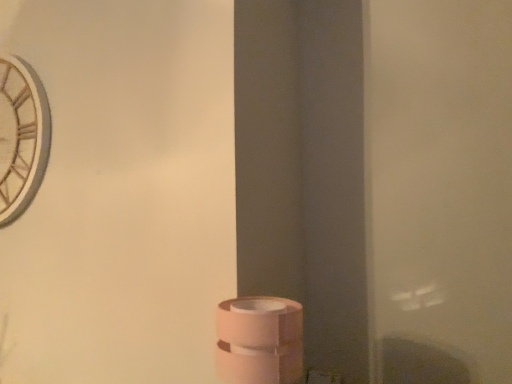
Where is `pink matte toilet paper at lower center`? The image size is (512, 384). pink matte toilet paper at lower center is located at coordinates (259, 341).

What is the approximate height of pink matte toilet paper at lower center?

pink matte toilet paper at lower center is 13.76 inches tall.

Image resolution: width=512 pixels, height=384 pixels. What do you see at coordinates (259, 341) in the screenshot? I see `pink matte toilet paper at lower center` at bounding box center [259, 341].

This screenshot has height=384, width=512. Describe the element at coordinates (21, 136) in the screenshot. I see `wooden clock at upper left` at that location.

Measure the distance between point (31, 94) and camera.

The depth of point (31, 94) is 1.38 meters.

The height and width of the screenshot is (384, 512). Find the location of `wooden clock at upper left`. wooden clock at upper left is located at coordinates (21, 136).

You are a GUI agent. You are given a task and a screenshot of the screen. Output one action in this format:
    pyautogui.click(x=<x>, y=<y>)
    Task: Click on the pink matte toilet paper at lower center
    The image size is (512, 384).
    Given the screenshot: What is the action you would take?
    pyautogui.click(x=259, y=341)

Between wooden clock at upper left and pink matte toilet paper at lower center, which one appears on the left side from the viewer's perspective?

wooden clock at upper left is more to the left.

Relative to pink matte toilet paper at lower center, is wooden clock at upper left in front or behind?

Visually, wooden clock at upper left is located behind pink matte toilet paper at lower center.

Considering the points (39, 106) and (227, 333), which point is in front, point (39, 106) or point (227, 333)?

Positioned in front is point (227, 333).

From the image's perspective, is wooden clock at upper left on pink matte toilet paper at lower center?

Correct, wooden clock at upper left appears higher than pink matte toilet paper at lower center in the image.

From a real-world perspective, does wooden clock at upper left sit lower than pink matte toilet paper at lower center?

No, from a real-world perspective, wooden clock at upper left is not below pink matte toilet paper at lower center.

Can you confirm if wooden clock at upper left is thinner than pink matte toilet paper at lower center?

Yes.

Can you confirm if wooden clock at upper left is shorter than pink matte toilet paper at lower center?

No, wooden clock at upper left is not shorter than pink matte toilet paper at lower center.

Is wooden clock at upper left bigger than pink matte toilet paper at lower center?

Indeed, wooden clock at upper left has a larger size compared to pink matte toilet paper at lower center.

Can we say wooden clock at upper left lies outside pink matte toilet paper at lower center?

Yes, wooden clock at upper left is not within pink matte toilet paper at lower center.

Is wooden clock at upper left not close to pink matte toilet paper at lower center?

No.

Is pink matte toilet paper at lower center at the back of wooden clock at upper left?

No.

Can you tell me how much wooden clock at upper left and pink matte toilet paper at lower center differ in facing direction?

They differ by 1.31 degrees in their facing directions.

Where is `toilet paper on the right side of wooden clock at upper left`? This screenshot has width=512, height=384. toilet paper on the right side of wooden clock at upper left is located at coordinates (259, 341).

Which object is positioned more to the left, pink matte toilet paper at lower center or wooden clock at upper left?

wooden clock at upper left is more to the left.

Does pink matte toilet paper at lower center come in front of wooden clock at upper left?

Yes.

Does point (262, 328) come closer to viewer compared to point (16, 143)?

Yes, point (262, 328) is in front of point (16, 143).

From the image's perspective, would you say pink matte toilet paper at lower center is shown under wooden clock at upper left?

Correct, pink matte toilet paper at lower center appears lower than wooden clock at upper left in the image.

From a real-world perspective, which object stands above the other?

In real-world perspective, wooden clock at upper left is above.

Does pink matte toilet paper at lower center have a lesser width compared to wooden clock at upper left?

Incorrect, the width of pink matte toilet paper at lower center is not less than that of wooden clock at upper left.

Can you confirm if pink matte toilet paper at lower center is taller than wooden clock at upper left?

Incorrect, the height of pink matte toilet paper at lower center is not larger of that of wooden clock at upper left.

Considering the sizes of objects pink matte toilet paper at lower center and wooden clock at upper left in the image provided, who is bigger, pink matte toilet paper at lower center or wooden clock at upper left?

Bigger between the two is wooden clock at upper left.

Can we say pink matte toilet paper at lower center lies outside wooden clock at upper left?

Yes, pink matte toilet paper at lower center is located beyond the bounds of wooden clock at upper left.

Would you say pink matte toilet paper at lower center is a long distance from wooden clock at upper left?

No, pink matte toilet paper at lower center is not far away from wooden clock at upper left.

Is pink matte toilet paper at lower center aimed at wooden clock at upper left?

No, pink matte toilet paper at lower center is not turned towards wooden clock at upper left.

Locate an element on the screen. This screenshot has height=384, width=512. clock above the pink matte toilet paper at lower center (from a real-world perspective) is located at coordinates [x=21, y=136].

I want to click on toilet paper that appears on the right of wooden clock at upper left, so click(x=259, y=341).

At what (x,y) coordinates should I click in order to perform the action: click on clock located above the pink matte toilet paper at lower center (from a real-world perspective). Please return your answer as a coordinate pair (x, y). The height and width of the screenshot is (384, 512). Looking at the image, I should click on (21, 136).